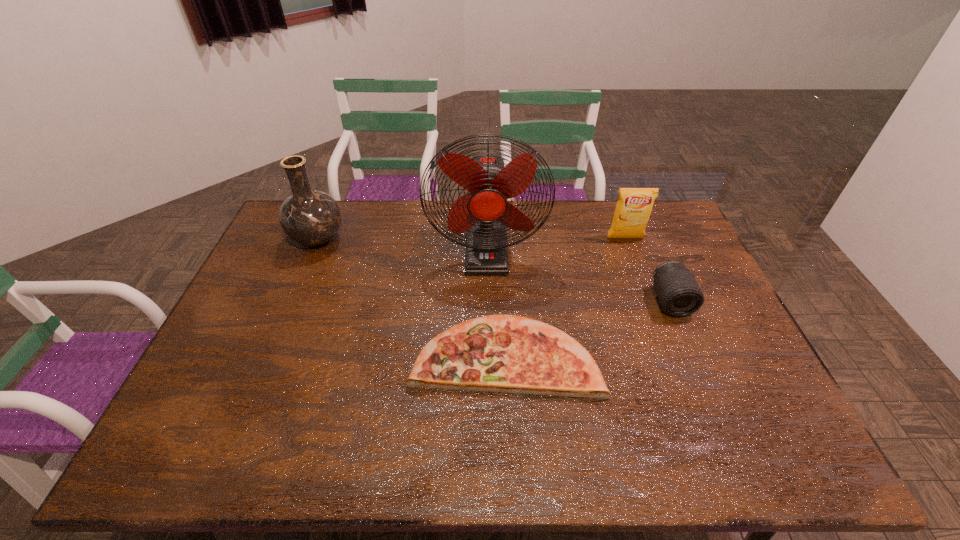
At what (x,y) coordinates should I click in order to perform the action: click on the tallest object. Please return your answer as a coordinate pair (x, y). Looking at the image, I should click on (484, 213).

Identify the location of the leftmost object. (309, 217).

The width and height of the screenshot is (960, 540). In order to click on the fourth shortest object in this screenshot , I will do `click(309, 217)`.

Image resolution: width=960 pixels, height=540 pixels. I want to click on the third tallest object, so click(634, 206).

At what (x,y) coordinates should I click in order to perform the action: click on the second shortest object. Please return your answer as a coordinate pair (x, y). Looking at the image, I should click on (679, 294).

This screenshot has height=540, width=960. I want to click on the shortest object, so click(x=496, y=353).

At what (x,y) coordinates should I click in order to perform the action: click on free space located 0.100m on the front-facing side of the tallest object. Please return your answer as a coordinate pair (x, y). Looking at the image, I should click on pos(487,299).

Locate an element on the screen. Image resolution: width=960 pixels, height=540 pixels. vacant space located 0.100m on the front of the fourth shortest object is located at coordinates (301, 279).

This screenshot has width=960, height=540. Identify the location of vacant space situated on the front of the crisp (potato chip) with the logo. (658, 325).

The width and height of the screenshot is (960, 540). Identify the location of free space located on the surface of the telephoto lens. (696, 362).